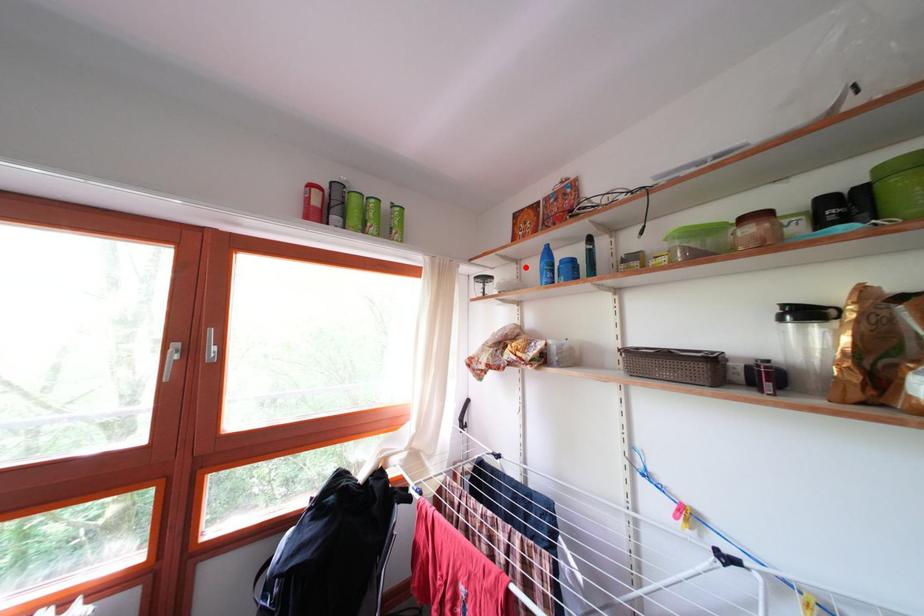
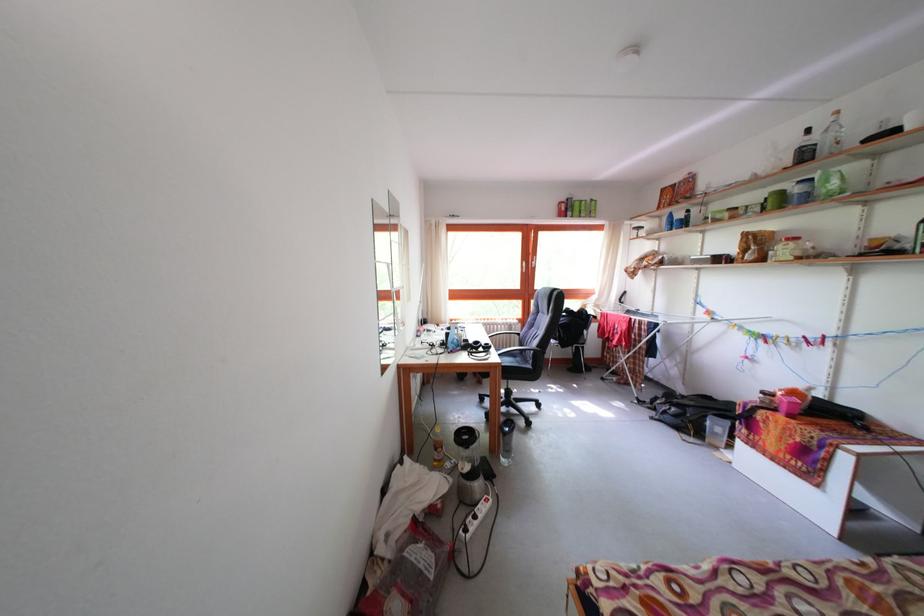
In the second image, find the point that corresponds to the highlighted location in the first image.

(667, 224)